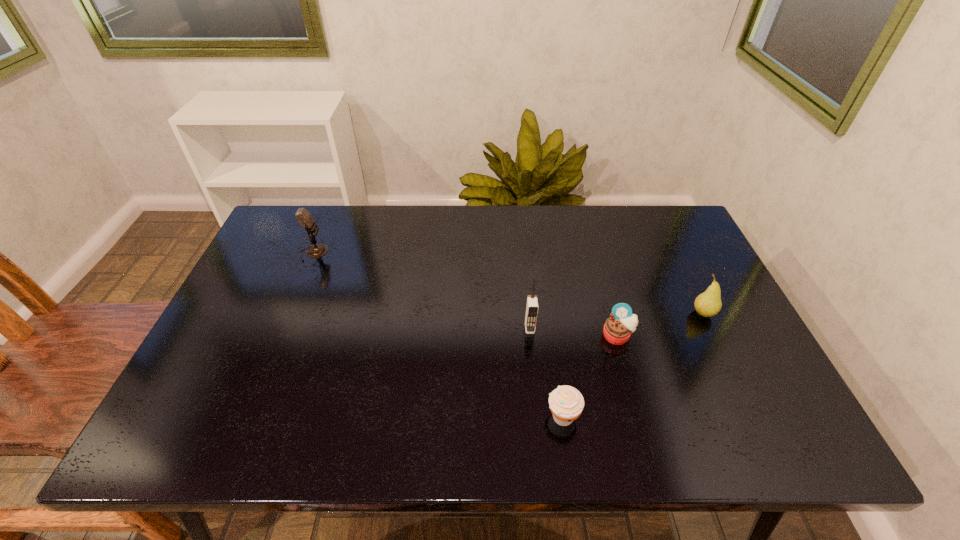
You are a GUI agent. You are given a task and a screenshot of the screen. Output one action in this format:
    pyautogui.click(x=<x>, y=<y>)
    Task: Click on the free spot between the farther muffin and the fourth object from right to left
    The height and width of the screenshot is (540, 960).
    Given the screenshot: What is the action you would take?
    pyautogui.click(x=573, y=332)

The height and width of the screenshot is (540, 960). I want to click on vacant area that lies between the cellular telephone and the third object from right to left, so click(546, 372).

Locate an element on the screen. The width and height of the screenshot is (960, 540). free point between the microphone and the third object from left to right is located at coordinates (438, 335).

The image size is (960, 540). I want to click on vacant area between the farthest object and the second object from left to right, so click(421, 291).

Where is `vacant space in between the leftmost object and the fourth object from left to right`? Image resolution: width=960 pixels, height=540 pixels. vacant space in between the leftmost object and the fourth object from left to right is located at coordinates (466, 294).

Identify which object is the second closest to the fourth object from right to left. Please provide its 2D coordinates. Your answer should be formatted as a tuple, i.e. [(x, y)], where the tuple contains the x and y coordinates of a point satisfying the conditions above.

[(566, 403)]

The image size is (960, 540). What are the coordinates of `object that is the closest to the nearer muffin` in the screenshot? It's located at (618, 328).

I want to click on blank space that satisfies the following two spatial constraints: 1. on the front-facing side of the farthest object; 2. on the back side of the third shortest object, so click(x=288, y=314).

The width and height of the screenshot is (960, 540). I want to click on blank area in the image that satisfies the following two spatial constraints: 1. on the back side of the third tallest object; 2. on the front-facing side of the microphone, so point(674,253).

The width and height of the screenshot is (960, 540). I want to click on vacant point that satisfies the following two spatial constraints: 1. on the front-facing side of the rightmost object; 2. on the left side of the farthest object, so click(288, 314).